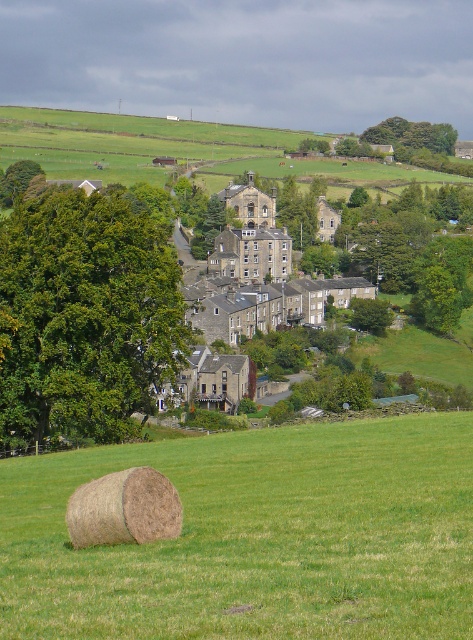
Question: Is green grassy hillside at upper center further to the viewer compared to stone houses at center?

Choices:
 (A) yes
 (B) no

Answer: (A)

Question: Which point is farther from the camera taking this photo?

Choices:
 (A) (16, 184)
 (B) (411, 144)
 (C) (242, 332)

Answer: (B)

Question: Does brown hay bale at lower left come in front of brown straw bale at lower left?

Choices:
 (A) yes
 (B) no

Answer: (A)

Question: Among these objects, which one is nearest to the camera?

Choices:
 (A) stone houses at center
 (B) brown hay bale at lower left

Answer: (B)

Question: Is brown hay bale at lower left in front of green leafy tree at upper center?

Choices:
 (A) no
 (B) yes

Answer: (B)

Question: Which object is farther from the camera taking this photo?

Choices:
 (A) brown hay bale at lower left
 (B) stone houses at center

Answer: (B)